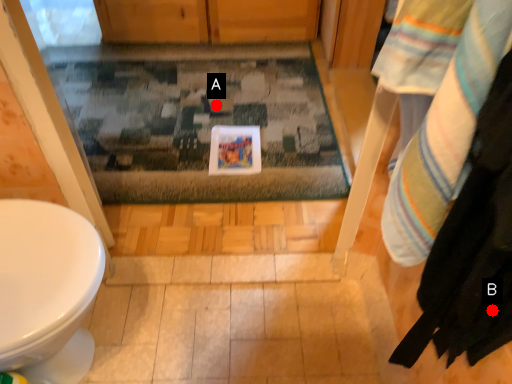
Question: Two points are circled on the image, labeled by A and B beside each circle. Which point is farther from the camera taking this photo?

Choices:
 (A) A is further
 (B) B is further

Answer: (A)